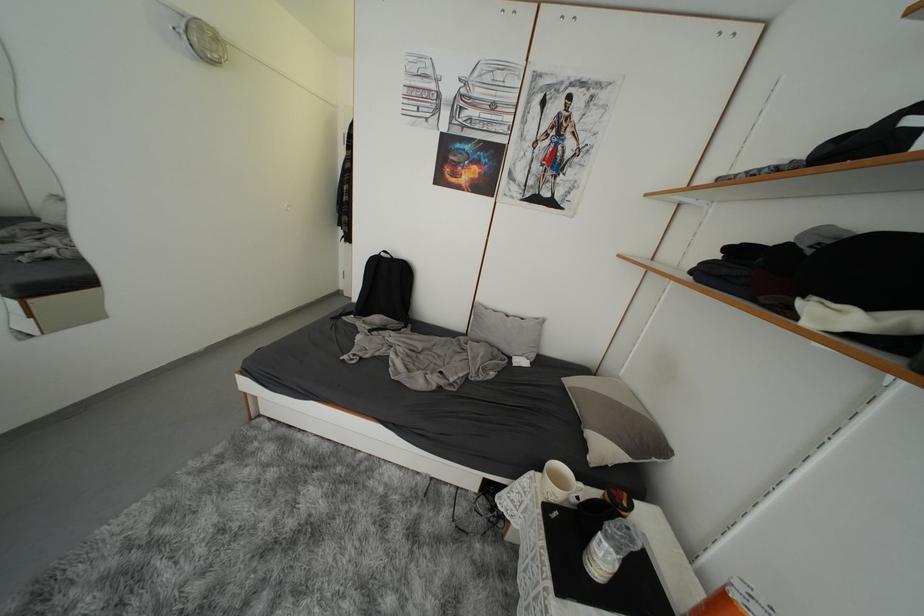
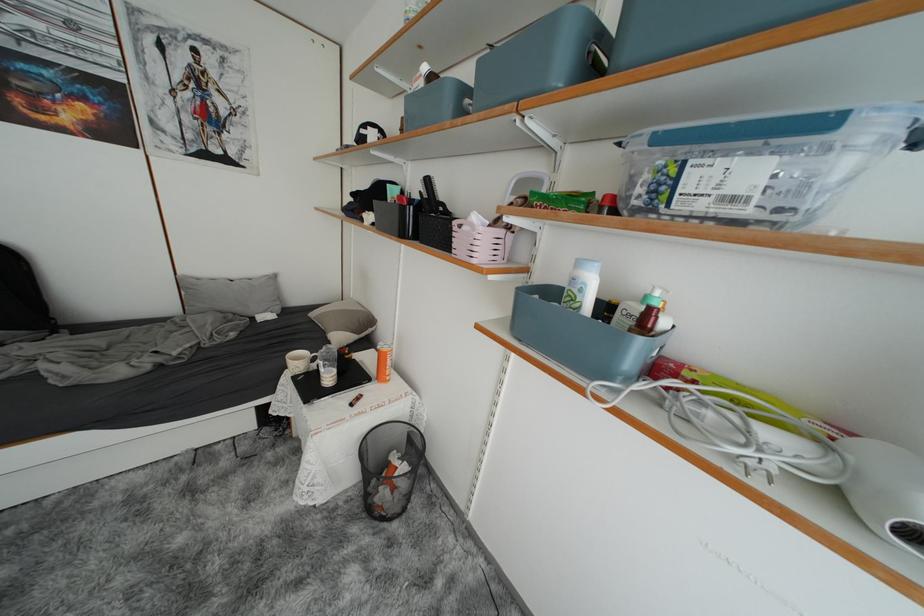
Where in the second image is the point corresponding to [516,315] from the first image?

(238, 281)